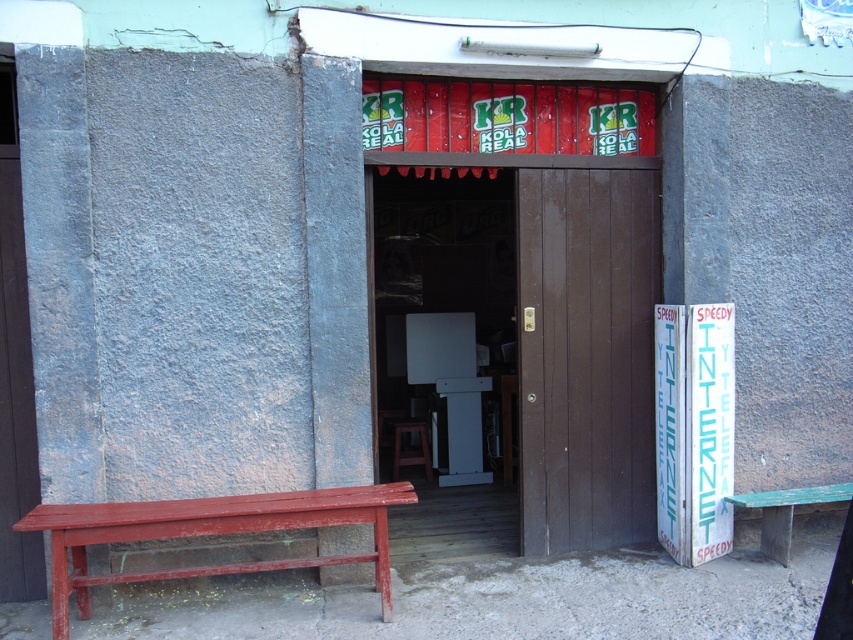
You are standing in front of the shop entrance and want to sit down. There is a brown wooden door at center and a green wooden bench at lower right. Which object is closer to you so you can sit on it?

The brown wooden door at center is closer to you than the green wooden bench at lower right, so you can sit on the green wooden bench at lower right.

You are a customer entering the shop and need to sit down. You see the rustic wood bench at left and the brown wooden stool at center. Which seating option provides more space for your belongings?

The rustic wood bench at left has a larger size compared to the brown wooden stool at center, so it provides more space for your belongings.

You are standing at the entrance of the shop. There is a point marked at coordinates (585, 355). What object does this point correspond to?

The point corresponds to the brown wooden door at center.